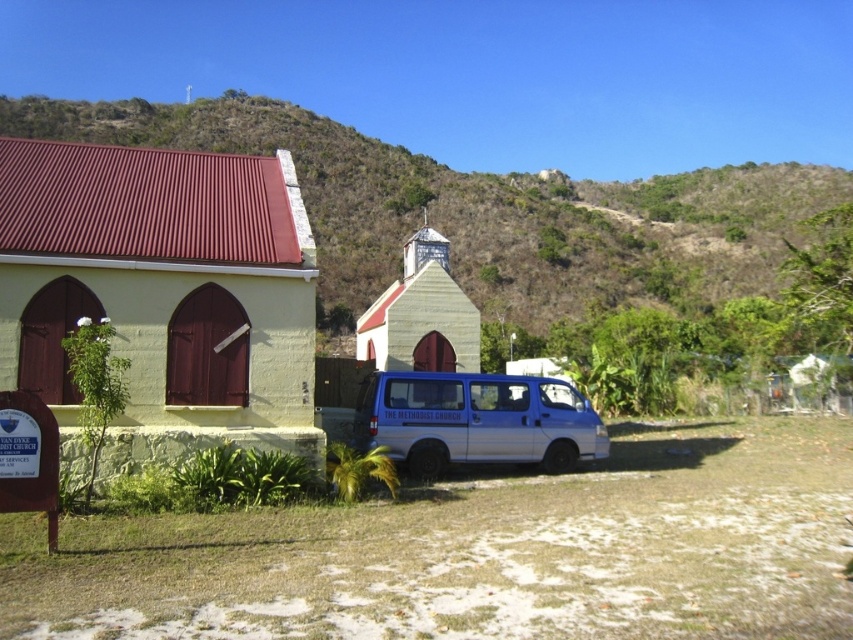
You are standing at the entrance of the small yellow building with red shutters. You want to walk directly towards the yellow matte church at center. What direction should you head?

The yellow matte church at center is located at point (160, 292), so you should head towards the direction of the church which is to the right of the small yellow building with red shutters as per the coordinates provided.

From the picture: You are a photographer planning to take a landscape photo of the yellow matte church at center and the green grassy hillside at upper center. Which of the two objects will appear smaller in the photo?

The yellow matte church at center will appear smaller in the photo because it is smaller than the green grassy hillside at upper center.

You are standing at the point marked by the coordinates point (x=160, y=292) in the image. Which object are you directly facing?

You are directly facing the yellow matte church at center, as the point (x=160, y=292) marks its location.